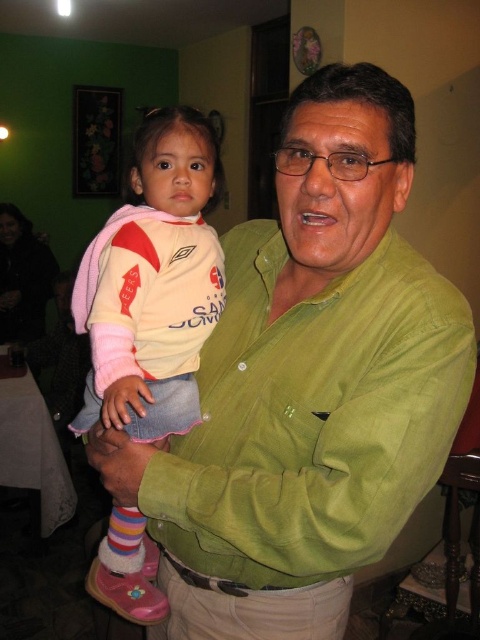
This screenshot has width=480, height=640. I want to click on green suede shirt at center, so click(307, 385).

You are a GUI agent. You are given a task and a screenshot of the screen. Output one action in this format:
    pyautogui.click(x=<x>, y=<y>)
    Task: Click on the green suede shirt at center
    This screenshot has height=640, width=480.
    Given the screenshot: What is the action you would take?
    pos(307,385)

Does green corduroy shirt at center have a larger size compared to pink fabric shirt at center?

Incorrect, green corduroy shirt at center is not larger than pink fabric shirt at center.

Is the position of green corduroy shirt at center less distant than that of pink fabric shirt at center?

Yes, it is.

The height and width of the screenshot is (640, 480). Identify the location of green corduroy shirt at center. (305, 436).

Is green suede shirt at center to the left of pink fabric shirt at center from the viewer's perspective?

Incorrect, green suede shirt at center is not on the left side of pink fabric shirt at center.

Is green suede shirt at center closer to camera compared to pink fabric shirt at center?

That is True.

Identify the location of green suede shirt at center. The image size is (480, 640). (307, 385).

This screenshot has height=640, width=480. In order to click on green suede shirt at center in this screenshot , I will do `click(307, 385)`.